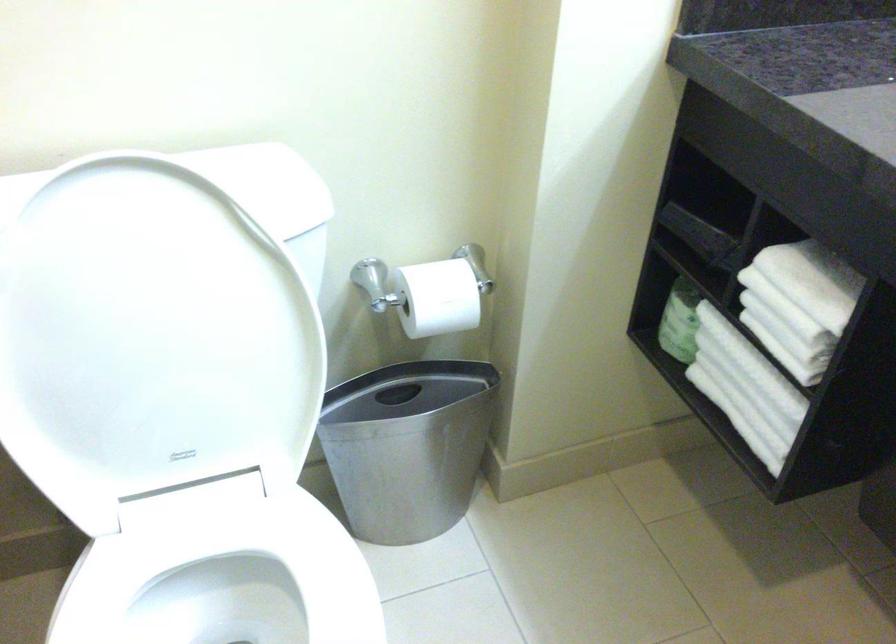
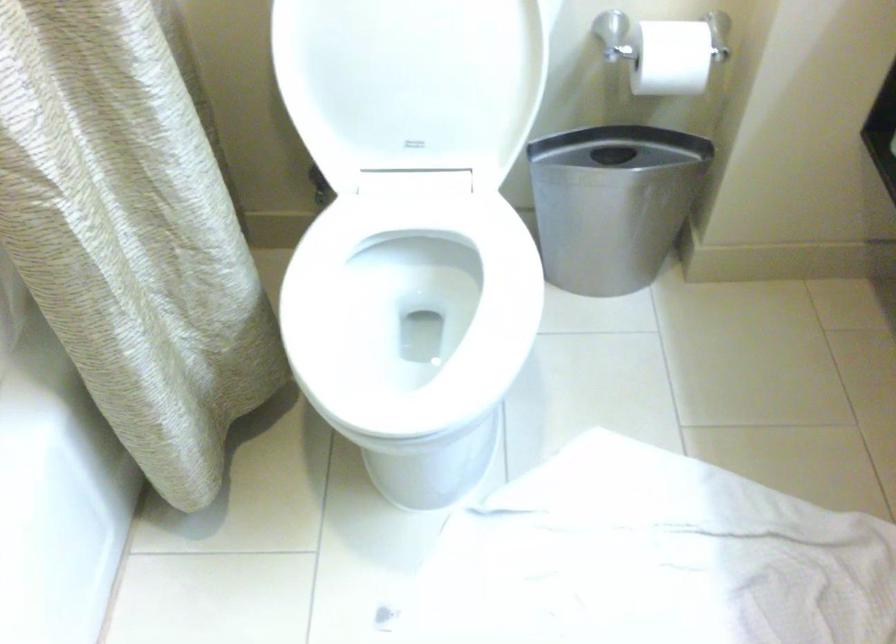
Question: The first image is from the beginning of the video and the second image is from the end. How did the camera likely rotate when shooting the video?

Choices:
 (A) Left
 (B) Right
 (C) Up
 (D) Down

Answer: (A)